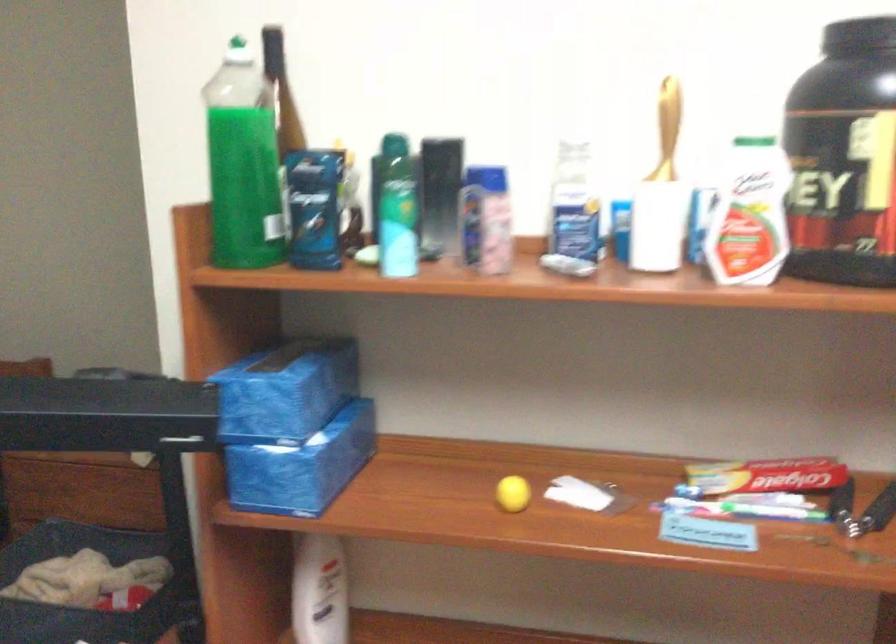
What are the coordinates of `white and red bottle` in the screenshot? It's located at (748, 214).